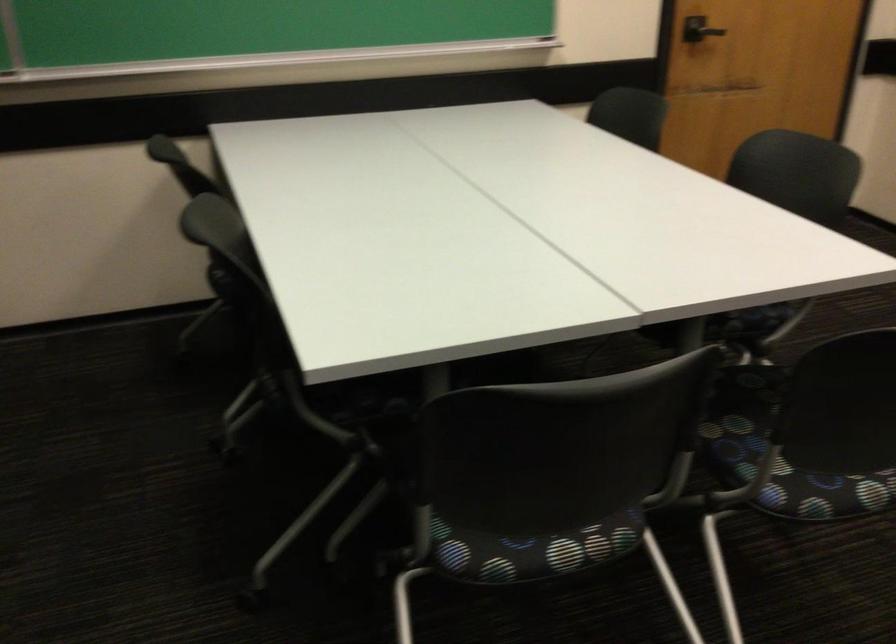
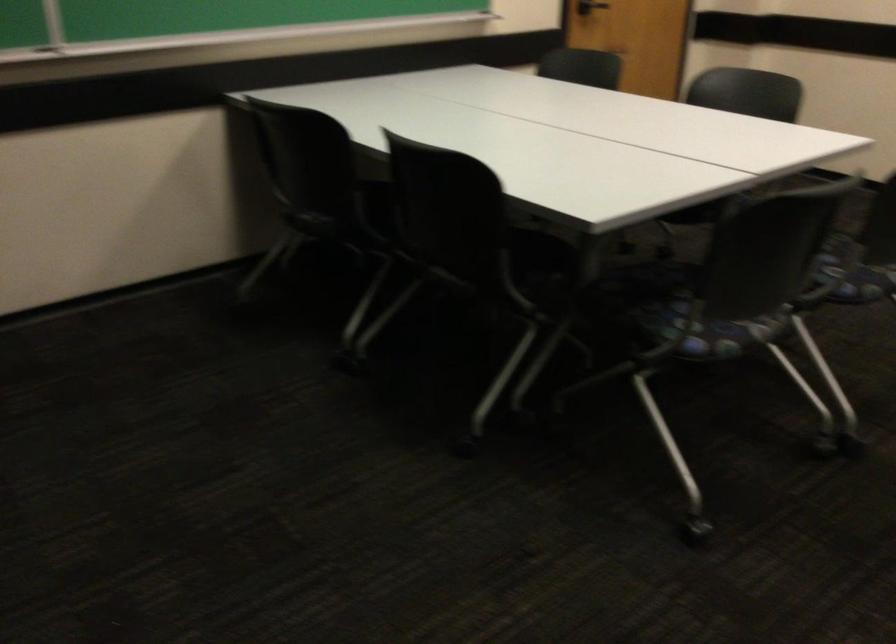
In the second image, find the point that corresponds to [217,281] in the first image.

(320, 225)